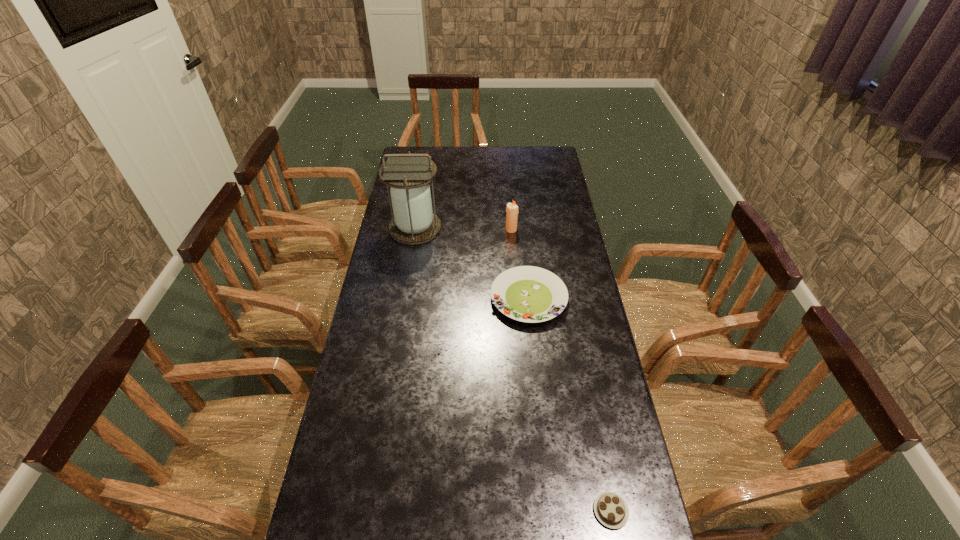
Image resolution: width=960 pixels, height=540 pixels. I want to click on vacant region that satisfies the following two spatial constraints: 1. on the front side of the tallest object; 2. on the left side of the shortest object, so click(369, 511).

Where is `free location that satisfies the following two spatial constraints: 1. on the front side of the second tallest object; 2. on the left side of the second nearest object`? free location that satisfies the following two spatial constraints: 1. on the front side of the second tallest object; 2. on the left side of the second nearest object is located at coordinates (516, 298).